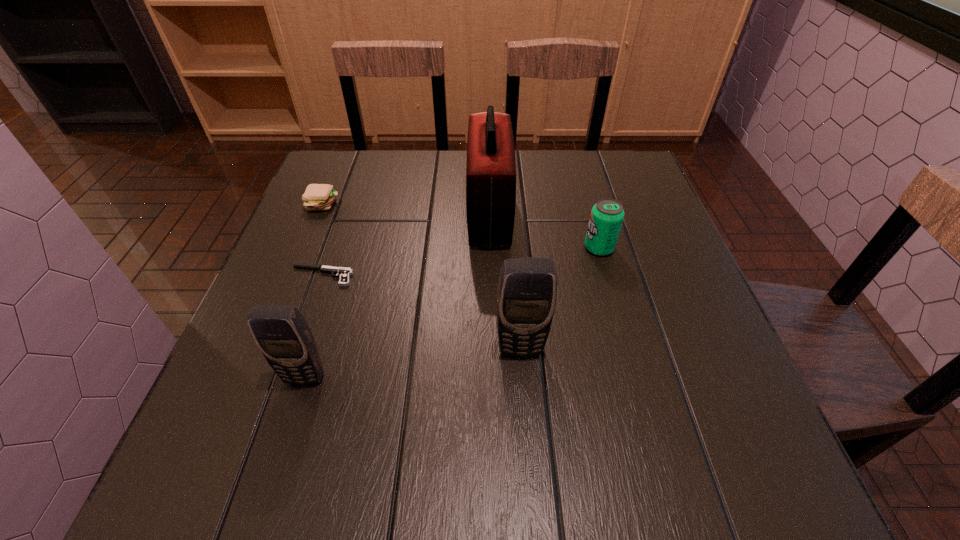
Please point a spot to add another cellular telephone on the right. Please provide its 2D coordinates. Your answer should be formatted as a tuple, i.e. [(x, y)], where the tuple contains the x and y coordinates of a point satisfying the conditions above.

[(715, 323)]